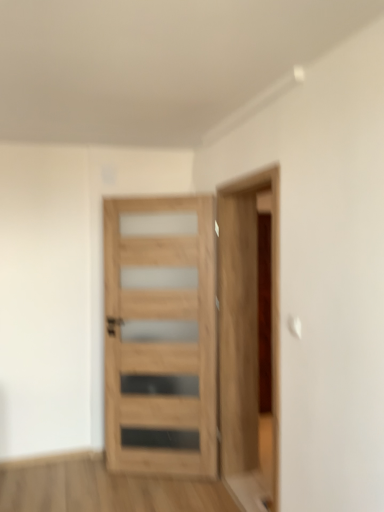
At what (x,y) coordinates should I click in order to perform the action: click on free space in front of natural wood door at center. Please return your answer as a coordinate pair (x, y). Looking at the image, I should click on point(163,494).